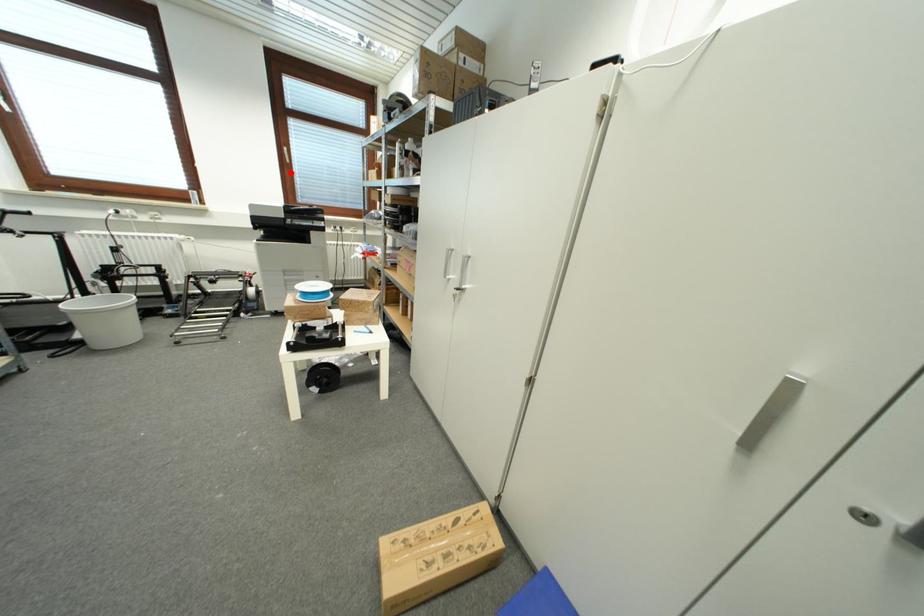
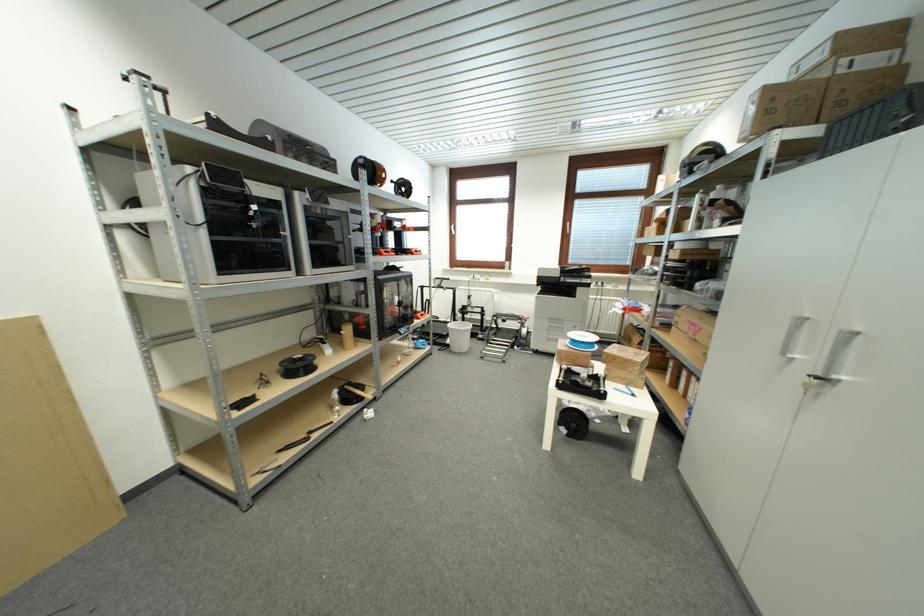
Question: I am providing you with two images of the same scene from different viewpoints. A red point is marked on the first image. Is the red point's position out of view in image 2?

Choices:
 (A) Yes
 (B) No

Answer: (B)